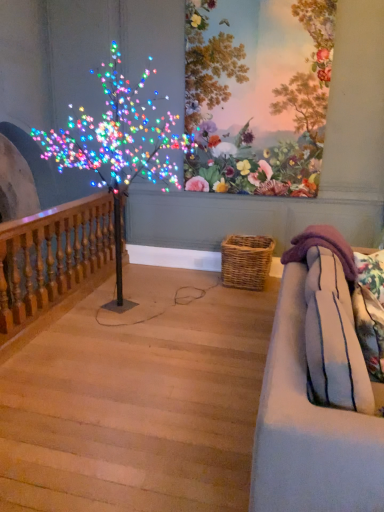
The image size is (384, 512). Find the location of `light blue fabric couch at right`. light blue fabric couch at right is located at coordinates (309, 430).

Where is `woven brown basket at lower center`? The width and height of the screenshot is (384, 512). woven brown basket at lower center is located at coordinates (246, 261).

Describe the element at coordinates (257, 96) in the screenshot. I see `floral wallpaper at upper center` at that location.

You are a GUI agent. You are given a task and a screenshot of the screen. Output one action in this format:
    pyautogui.click(x=<x>, y=<y>)
    Task: Click on the wooden baluster at left
    
    Given the screenshot: What is the action you would take?
    52,257

Locate an element on the screen. Image resolution: width=384 pixels, height=512 pixels. light blue fabric couch at right is located at coordinates (309, 430).

Is wooden baluster at left taller or shorter than light wood stairwell at lower left?

Clearly, wooden baluster at left is taller compared to light wood stairwell at lower left.

Choose the correct answer: Is wooden baluster at left inside light wood stairwell at lower left or outside it?

wooden baluster at left lies outside light wood stairwell at lower left.

Which object is closer to the camera, wooden baluster at left or light wood stairwell at lower left?

light wood stairwell at lower left.

Is wooden baluster at left next to light wood stairwell at lower left and touching it?

They are not placed beside each other.

Is floral wallpaper at upper center far away from light blue fabric couch at right?

Yes.

In the image, is floral wallpaper at upper center positioned in front of or behind light blue fabric couch at right?

floral wallpaper at upper center is behind light blue fabric couch at right.

Is floral wallpaper at upper center taller than light blue fabric couch at right?

Yes, floral wallpaper at upper center is taller than light blue fabric couch at right.

Does point (342, 431) appear closer or farther from the camera than point (42, 473)?

Point (342, 431) appears to be closer to the viewer than point (42, 473).

Consider the image. Does light blue fabric couch at right turn towards light wood stairwell at lower left?

No, light blue fabric couch at right is not facing towards light wood stairwell at lower left.

Is light blue fabric couch at right positioned far away from light wood stairwell at lower left?

Yes, light blue fabric couch at right and light wood stairwell at lower left are located far from each other.

In order to click on stairwell behind the light blue fabric couch at right in this screenshot , I will do `click(138, 400)`.

Based on the photo, is woven brown basket at lower center located outside light wood stairwell at lower left?

Yes, woven brown basket at lower center is outside of light wood stairwell at lower left.

From the image's perspective, which one is positioned lower, woven brown basket at lower center or light wood stairwell at lower left?

light wood stairwell at lower left is shown below in the image.

Between woven brown basket at lower center and light wood stairwell at lower left, which one is positioned in front?

light wood stairwell at lower left.

Considering the sizes of objects wooden baluster at left and woven brown basket at lower center in the image provided, who is taller, wooden baluster at left or woven brown basket at lower center?

With more height is wooden baluster at left.

From a real-world perspective, who is located higher, wooden baluster at left or woven brown basket at lower center?

wooden baluster at left is physically above.

In order to click on rail on the left of woven brown basket at lower center in this screenshot , I will do coord(52,257).

Which is correct: wooden baluster at left is inside woven brown basket at lower center, or outside of it?

The correct answer is: outside.

From the image's perspective, which one is positioned higher, light wood stairwell at lower left or floral wallpaper at upper center?

floral wallpaper at upper center is shown above in the image.

Does point (26, 358) come farther from viewer compared to point (223, 80)?

No.

Who is smaller, light wood stairwell at lower left or floral wallpaper at upper center?

With smaller size is floral wallpaper at upper center.

This screenshot has width=384, height=512. I want to click on stairwell in front of the floral wallpaper at upper center, so click(x=138, y=400).

Is floral wallpaper at upper center in contact with light wood stairwell at lower left?

floral wallpaper at upper center and light wood stairwell at lower left are not in contact.

Can you confirm if floral wallpaper at upper center is positioned to the right of light wood stairwell at lower left?

Indeed, floral wallpaper at upper center is positioned on the right side of light wood stairwell at lower left.

From a real-world perspective, is floral wallpaper at upper center on top of light wood stairwell at lower left?

Indeed, from a real-world perspective, floral wallpaper at upper center stands above light wood stairwell at lower left.

Considering the relative sizes of floral wallpaper at upper center and light wood stairwell at lower left in the image provided, is floral wallpaper at upper center taller than light wood stairwell at lower left?

Indeed, floral wallpaper at upper center has a greater height compared to light wood stairwell at lower left.

You are a GUI agent. You are given a task and a screenshot of the screen. Output one action in this format:
    pyautogui.click(x=<x>, y=<y>)
    Task: Click on the rail above the light wood stairwell at lower left (from the image's perspective)
    This screenshot has width=384, height=512.
    Given the screenshot: What is the action you would take?
    pyautogui.click(x=52, y=257)

Image resolution: width=384 pixels, height=512 pixels. What are the coordinates of `floral arrangement that is on the left side of light blue fabric couch at right` in the screenshot? It's located at (257, 96).

Looking at the image, which one is located closer to light wood stairwell at lower left, woven brown basket at lower center or floral wallpaper at upper center?

woven brown basket at lower center is closer to light wood stairwell at lower left.

Based on their spatial positions, is wooden baluster at left or light blue fabric couch at right closer to floral wallpaper at upper center?

wooden baluster at left is closer to floral wallpaper at upper center.

Estimate the real-world distances between objects in this image. Which object is closer to light blue fabric couch at right, wooden baluster at left or woven brown basket at lower center?

wooden baluster at left lies closer to light blue fabric couch at right than the other object.

From the picture: From the image, which object appears to be farther from light blue fabric couch at right, floral wallpaper at upper center or light wood stairwell at lower left?

The object further to light blue fabric couch at right is floral wallpaper at upper center.

Estimate the real-world distances between objects in this image. Which object is further from woven brown basket at lower center, light wood stairwell at lower left or floral wallpaper at upper center?

light wood stairwell at lower left is positioned further to the anchor woven brown basket at lower center.

Based on their spatial positions, is floral wallpaper at upper center or wooden baluster at left further from woven brown basket at lower center?

The object further to woven brown basket at lower center is wooden baluster at left.

Looking at the image, which one is located further to light wood stairwell at lower left, wooden baluster at left or woven brown basket at lower center?

woven brown basket at lower center is positioned further to the anchor light wood stairwell at lower left.

When comparing their distances from wooden baluster at left, does light blue fabric couch at right or light wood stairwell at lower left seem closer?

Among the two, light wood stairwell at lower left is located nearer to wooden baluster at left.

Find the location of `floral arrangement between light wood stairwell at lower left and woven brown basket at lower center from front to back`. floral arrangement between light wood stairwell at lower left and woven brown basket at lower center from front to back is located at coordinates (257, 96).

The image size is (384, 512). What are the coordinates of `basket between wooden baluster at left and floral wallpaper at upper center in the horizontal direction` in the screenshot? It's located at (246, 261).

You are a GUI agent. You are given a task and a screenshot of the screen. Output one action in this format:
    pyautogui.click(x=<x>, y=<y>)
    Task: Click on the rail between light blue fabric couch at right and floral wallpaper at upper center in the front-back direction
    Image resolution: width=384 pixels, height=512 pixels.
    Given the screenshot: What is the action you would take?
    pyautogui.click(x=52, y=257)

Identify the location of stairwell between light blue fabric couch at right and woven brown basket at lower center in the front-back direction. (138, 400).